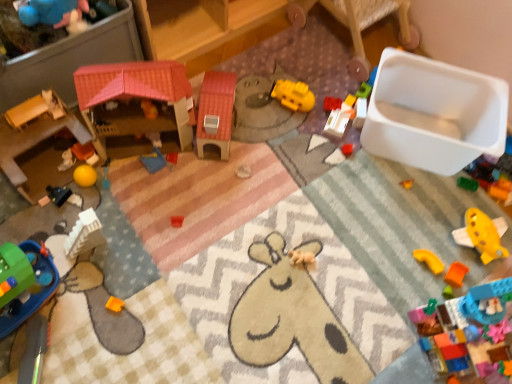
The height and width of the screenshot is (384, 512). I want to click on yellow matte plastic arch at lower right, which appears as the twelfth toy when viewed from the left, so click(429, 260).

This screenshot has width=512, height=384. What do you see at coordinates (355, 23) in the screenshot?
I see `white plastic container at upper right, which ranks as the 2th furniture in left-to-right order` at bounding box center [355, 23].

Locate an element on the screen. yellow plastic block at upper center, which appears as the 11th toy when viewed from the left is located at coordinates (350, 100).

What are the coordinates of `white plastic container at center, acting as the 10th toy starting from the left` in the screenshot? It's located at (337, 122).

Measure the distance between point (498, 218) and camera.

Point (498, 218) is 4.69 feet from camera.

This screenshot has width=512, height=384. Describe the element at coordinates (482, 235) in the screenshot. I see `yellow plastic airplane at lower right, arranged as the 15th toy when viewed from the left` at that location.

Identify the location of yellow matte plastic arch at lower right, which appears as the twelfth toy when viewed from the left. (429, 260).

Can you confirm if yellow matte plastic toy at center, which is the 8th toy from left to right, is shorter than blue plastic tray at center, acting as the 6th toy starting from the left?

No.

Considering the relative positions of yellow matte plastic toy at center, which is the 8th toy from right to left, and blue plastic tray at center, acting as the 6th toy starting from the left, in the image provided, is yellow matte plastic toy at center, which is the 8th toy from right to left, to the right of blue plastic tray at center, acting as the 6th toy starting from the left, from the viewer's perspective?

Yes, yellow matte plastic toy at center, which is the 8th toy from right to left, is to the right of blue plastic tray at center, acting as the 6th toy starting from the left.

Which of these two, yellow matte plastic toy at center, which is the 8th toy from left to right, or blue plastic tray at center, acting as the 6th toy starting from the left, is thinner?

blue plastic tray at center, acting as the 6th toy starting from the left.

From a real-world perspective, is yellow matte plastic toy at center, which is the 8th toy from left to right, located higher than blue plastic tray at center, which ranks as the 10th toy in right-to-left order?

Yes, from a real-world perspective, yellow matte plastic toy at center, which is the 8th toy from left to right, is on top of blue plastic tray at center, which ranks as the 10th toy in right-to-left order.

Who is bigger, smooth wooden dollhouse at left, the 1th toy in the left-to-right sequence, or matte blue rubber duck at upper left, the 4th toy from the left?

smooth wooden dollhouse at left, the 1th toy in the left-to-right sequence, is bigger.

Would you say matte blue rubber duck at upper left, which ranks as the 12th toy in right-to-left order, is part of smooth wooden dollhouse at left, placed as the 15th toy when sorted from right to left,'s contents?

Definitely not — matte blue rubber duck at upper left, which ranks as the 12th toy in right-to-left order, is not inside smooth wooden dollhouse at left, placed as the 15th toy when sorted from right to left.

Can you confirm if smooth wooden dollhouse at left, placed as the 15th toy when sorted from right to left, is taller than matte blue rubber duck at upper left, the 4th toy from the left?

Correct, smooth wooden dollhouse at left, placed as the 15th toy when sorted from right to left, is much taller as matte blue rubber duck at upper left, the 4th toy from the left.

From the image's perspective, is smooth wooden dollhouse at left, placed as the 15th toy when sorted from right to left, beneath matte blue rubber duck at upper left, which ranks as the 12th toy in right-to-left order?

Yes, from the image's perspective, smooth wooden dollhouse at left, placed as the 15th toy when sorted from right to left, is beneath matte blue rubber duck at upper left, which ranks as the 12th toy in right-to-left order.

Which object is further away from the camera taking this photo, blue plastic tray at center, acting as the 6th toy starting from the left, or bright red plastic blocks at center, which ranks as the seventh toy in right-to-left order?

bright red plastic blocks at center, which ranks as the seventh toy in right-to-left order, is behind.

Does blue plastic tray at center, acting as the 6th toy starting from the left, have a larger size compared to bright red plastic blocks at center, which ranks as the ninth toy in left-to-right order?

Yes.

Can you confirm if blue plastic tray at center, acting as the 6th toy starting from the left, is positioned to the left of bright red plastic blocks at center, which ranks as the seventh toy in right-to-left order?

Indeed, blue plastic tray at center, acting as the 6th toy starting from the left, is positioned on the left side of bright red plastic blocks at center, which ranks as the seventh toy in right-to-left order.

Which of these two, pink plastic house at upper center, arranged as the 1th furniture when viewed from the left, or green plastic toy at lower left, the fourteenth toy viewed from the right, stands shorter?

With less height is green plastic toy at lower left, the fourteenth toy viewed from the right.

Can you confirm if pink plastic house at upper center, arranged as the 1th furniture when viewed from the left, is smaller than green plastic toy at lower left, acting as the second toy starting from the left?

Actually, pink plastic house at upper center, arranged as the 1th furniture when viewed from the left, might be larger than green plastic toy at lower left, acting as the second toy starting from the left.

Is green plastic toy at lower left, acting as the second toy starting from the left, at the back of pink plastic house at upper center, the second furniture in the right-to-left sequence?

pink plastic house at upper center, the second furniture in the right-to-left sequence, is not turned away from green plastic toy at lower left, acting as the second toy starting from the left.

Relative to green plastic toy at lower left, acting as the second toy starting from the left, is pink plastic house at upper center, arranged as the 1th furniture when viewed from the left, in front or behind?

pink plastic house at upper center, arranged as the 1th furniture when viewed from the left, is positioned farther from the viewer than green plastic toy at lower left, acting as the second toy starting from the left.

Is blue plastic tray at center, which ranks as the 10th toy in right-to-left order, next to white plastic container at upper right, the 1th furniture when ordered from right to left?

They are not placed beside each other.

What's the angular difference between blue plastic tray at center, which ranks as the 10th toy in right-to-left order, and white plastic container at upper right, which ranks as the 2th furniture in left-to-right order,'s facing directions?

There is a 6.15-degree angle between the facing directions of blue plastic tray at center, which ranks as the 10th toy in right-to-left order, and white plastic container at upper right, which ranks as the 2th furniture in left-to-right order.

Does blue plastic tray at center, which ranks as the 10th toy in right-to-left order, have a greater width compared to white plastic container at upper right, which ranks as the 2th furniture in left-to-right order?

In fact, blue plastic tray at center, which ranks as the 10th toy in right-to-left order, might be narrower than white plastic container at upper right, which ranks as the 2th furniture in left-to-right order.

Is point (432, 270) positioned behind point (447, 281)?

Yes.

Looking at this image, how many degrees apart are the facing directions of yellow matte plastic arch at lower right, acting as the 4th toy starting from the right, and orange matte block at lower right, which ranks as the second toy in right-to-left order?

The angular difference between yellow matte plastic arch at lower right, acting as the 4th toy starting from the right, and orange matte block at lower right, which ranks as the second toy in right-to-left order, is 2.46 degrees.

From the image's perspective, count 2nd toys upward from the orange matte block at lower right, which ranks as the second toy in right-to-left order, and point to it. Please provide its 2D coordinates.

[(429, 260)]

From the image's perspective, which one is positioned higher, yellow matte plastic arch at lower right, which appears as the twelfth toy when viewed from the left, or orange matte block at lower right, acting as the 14th toy starting from the left?

From the image's view, yellow matte plastic arch at lower right, which appears as the twelfth toy when viewed from the left, is above.

Is matte orange blocks at left, positioned as the fifth toy in left-to-right order, smaller than bright red plastic blocks at center, which ranks as the ninth toy in left-to-right order?

Incorrect, matte orange blocks at left, positioned as the fifth toy in left-to-right order, is not smaller in size than bright red plastic blocks at center, which ranks as the ninth toy in left-to-right order.

From the image's perspective, which one is positioned higher, matte orange blocks at left, positioned as the fifth toy in left-to-right order, or bright red plastic blocks at center, which ranks as the ninth toy in left-to-right order?

bright red plastic blocks at center, which ranks as the ninth toy in left-to-right order, is shown above in the image.

From a real-world perspective, is matte orange blocks at left, positioned as the fifth toy in left-to-right order, physically located above or below bright red plastic blocks at center, which ranks as the seventh toy in right-to-left order?

matte orange blocks at left, positioned as the fifth toy in left-to-right order, is situated higher than bright red plastic blocks at center, which ranks as the seventh toy in right-to-left order, in the real world.

Image resolution: width=512 pixels, height=384 pixels. I want to click on toy that is the 2nd one when counting leftward from the yellow matte plastic toy at center, which is the 8th toy from right to left, so click(x=154, y=161).

Starting from the smooth wooden dollhouse at left, placed as the 15th toy when sorted from right to left, which toy is the 3rd one to the right? Please provide its 2D coordinates.

[(55, 14)]

Estimate the real-world distances between objects in this image. Which object is closer to matte blue rubber duck at upper left, the 4th toy from the left, plastic pink house at center, the 7th toy in the left-to-right sequence, or orange matte block at lower right, which ranks as the second toy in right-to-left order?

plastic pink house at center, the 7th toy in the left-to-right sequence, lies closer to matte blue rubber duck at upper left, the 4th toy from the left, than the other object.

Considering their positions, is black plastic toy at lower left, the 13th toy from the right, positioned further to green plastic toy at lower left, acting as the second toy starting from the left, than white plastic container at upper right, which ranks as the 2th furniture in left-to-right order?

white plastic container at upper right, which ranks as the 2th furniture in left-to-right order, is further to green plastic toy at lower left, acting as the second toy starting from the left.

Looking at the image, which one is located further to green plastic toy at lower left, the fourteenth toy viewed from the right, orange matte block at lower right, which ranks as the second toy in right-to-left order, or matte blue rubber duck at upper left, the 4th toy from the left?

orange matte block at lower right, which ranks as the second toy in right-to-left order, is positioned further to the anchor green plastic toy at lower left, the fourteenth toy viewed from the right.

When comparing their distances from yellow plastic airplane at lower right, which appears as the first toy when viewed from the right, does black plastic toy at lower left, arranged as the 3th toy when viewed from the left, or bright red plastic blocks at center, which ranks as the seventh toy in right-to-left order, seem further?

Among the two, black plastic toy at lower left, arranged as the 3th toy when viewed from the left, is located further to yellow plastic airplane at lower right, which appears as the first toy when viewed from the right.

Looking at this image, which object lies nearer to the anchor point yellow matte plastic arch at lower right, acting as the 4th toy starting from the right, green plastic toy at lower left, acting as the second toy starting from the left, or pink plastic house at upper center, the second furniture in the right-to-left sequence?

pink plastic house at upper center, the second furniture in the right-to-left sequence, is closer to yellow matte plastic arch at lower right, acting as the 4th toy starting from the right.

Consider the image. When comparing their distances from orange matte block at lower right, acting as the 14th toy starting from the left, does white plastic container at upper right, the 1th furniture when ordered from right to left, or pink plastic house at upper center, arranged as the 1th furniture when viewed from the left, seem further?

pink plastic house at upper center, arranged as the 1th furniture when viewed from the left.

Considering their positions, is bright red plastic blocks at center, which ranks as the ninth toy in left-to-right order, positioned further to white plastic container at center, marked as the 6th toy in a right-to-left arrangement, than orange matte block at lower right, which ranks as the second toy in right-to-left order?

Based on the image, orange matte block at lower right, which ranks as the second toy in right-to-left order, appears to be further to white plastic container at center, marked as the 6th toy in a right-to-left arrangement.

Based on their spatial positions, is white plastic container at center, acting as the 10th toy starting from the left, or white plastic container at upper right, which ranks as the 2th furniture in left-to-right order, further from black plastic toy at lower left, the 13th toy from the right?

The object further to black plastic toy at lower left, the 13th toy from the right, is white plastic container at upper right, which ranks as the 2th furniture in left-to-right order.

Image resolution: width=512 pixels, height=384 pixels. I want to click on furniture between smooth wooden dollhouse at left, the 1th toy in the left-to-right sequence, and yellow plastic block at upper center, which appears as the 11th toy when viewed from the left, so click(198, 24).

Where is `furniture between black plastic toy at lower left, arranged as the 3th toy when viewed from the left, and white plastic container at upper right, the 1th furniture when ordered from right to left, in the horizontal direction`? This screenshot has width=512, height=384. furniture between black plastic toy at lower left, arranged as the 3th toy when viewed from the left, and white plastic container at upper right, the 1th furniture when ordered from right to left, in the horizontal direction is located at coordinates (198, 24).

Locate an element on the screen. furniture situated between smooth wooden dollhouse at left, the 1th toy in the left-to-right sequence, and yellow matte plastic toy at center, which is the 8th toy from left to right, from left to right is located at coordinates (198, 24).

The width and height of the screenshot is (512, 384). What are the coordinates of `furniture between black plastic toy at lower left, the 13th toy from the right, and bright red plastic blocks at center, which ranks as the ninth toy in left-to-right order, from left to right` in the screenshot? It's located at (198, 24).